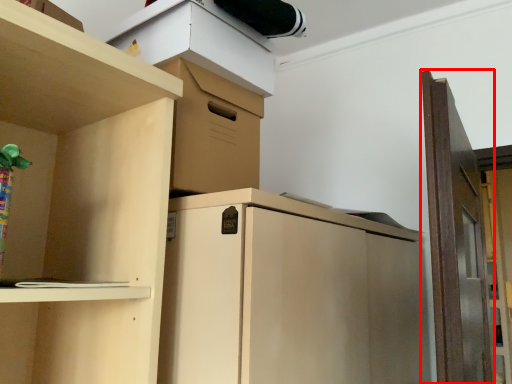
Question: From the image, what is the correct spatial relationship of door (annotated by the red box) in relation to cabinet?

Choices:
 (A) right
 (B) left

Answer: (A)